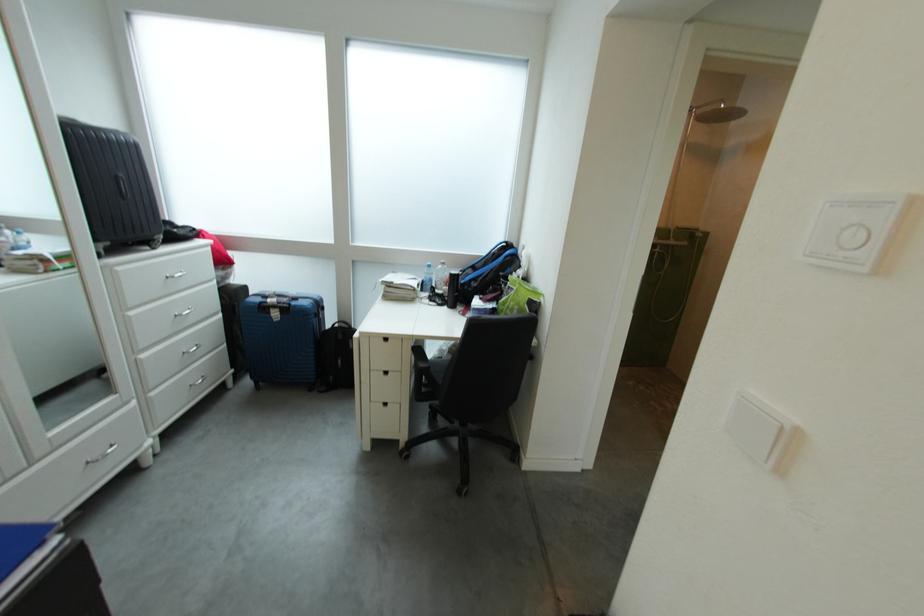
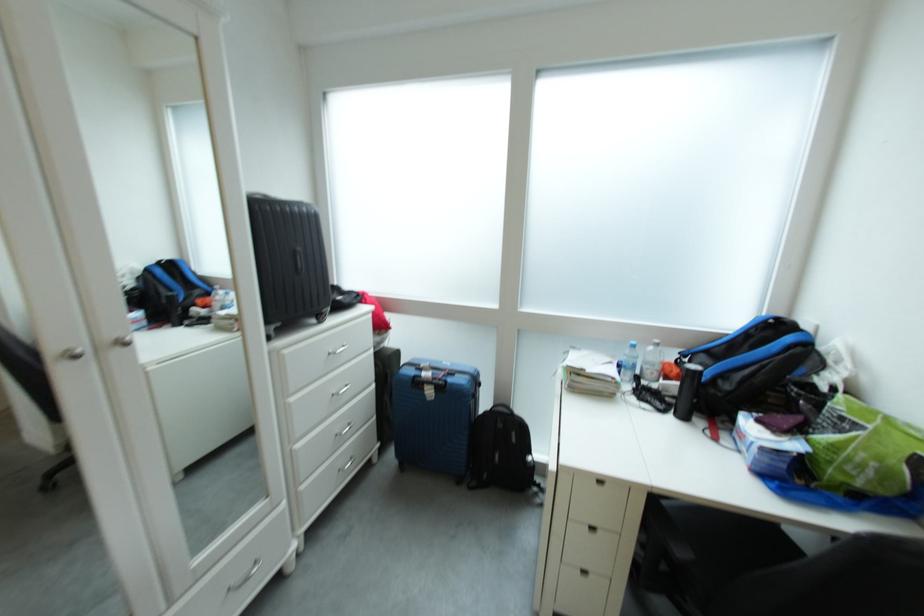
Question: The camera is either moving clockwise (left) or counter-clockwise (right) around the object. The first image is from the beginning of the video and the second image is from the end. Is the camera moving left or right when shooting the video?

Choices:
 (A) Left
 (B) Right

Answer: (B)